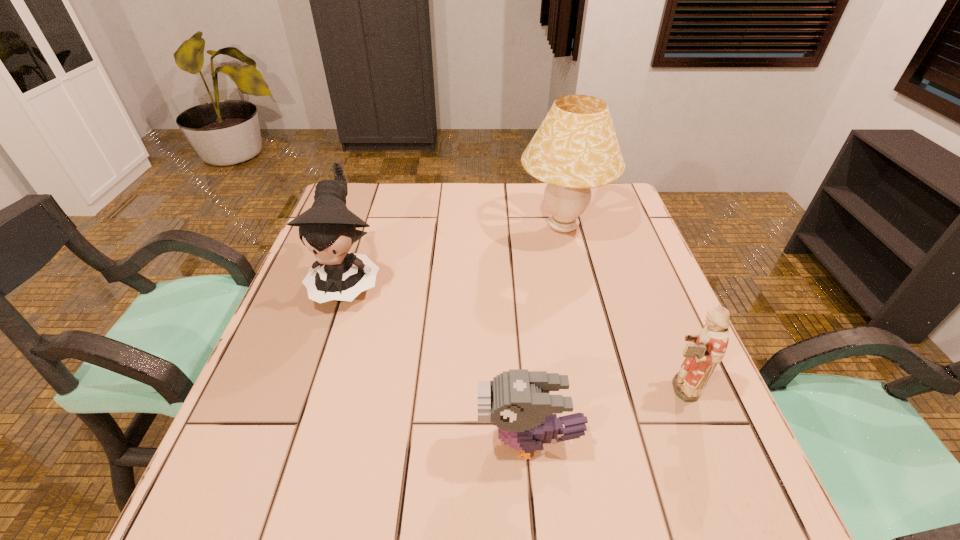
At what (x,y) coordinates should I click in order to perform the action: click on vacant space located 0.190m on the front-facing side of the second nearest object. Please return your answer as a coordinate pair (x, y). Looking at the image, I should click on (565, 388).

At what (x,y) coordinates should I click in order to perform the action: click on vacant space located on the front-facing side of the second nearest object. Please return your answer as a coordinate pair (x, y). Looking at the image, I should click on (496, 388).

At what (x,y) coordinates should I click in order to perform the action: click on free space located 0.220m at the beak of the nearest object. Please return your answer as a coordinate pair (x, y). Image resolution: width=960 pixels, height=540 pixels. Looking at the image, I should click on (356, 441).

The height and width of the screenshot is (540, 960). I want to click on blank space located at the beak of the nearest object, so click(x=373, y=441).

The height and width of the screenshot is (540, 960). I want to click on vacant space situated at the beak of the nearest object, so click(412, 441).

The image size is (960, 540). Identify the location of object located in the far edge section of the desktop. (575, 148).

Identify the location of object situated at the left edge. This screenshot has width=960, height=540. (328, 229).

At what (x,y) coordinates should I click in order to perform the action: click on lampshade positioned at the right edge. Please return your answer as a coordinate pair (x, y). Looking at the image, I should click on (575, 148).

Where is `figurine present at the right edge`? This screenshot has width=960, height=540. figurine present at the right edge is located at coordinates (710, 346).

Locate an element on the screen. This screenshot has width=960, height=540. object that is at the far right corner is located at coordinates (575, 148).